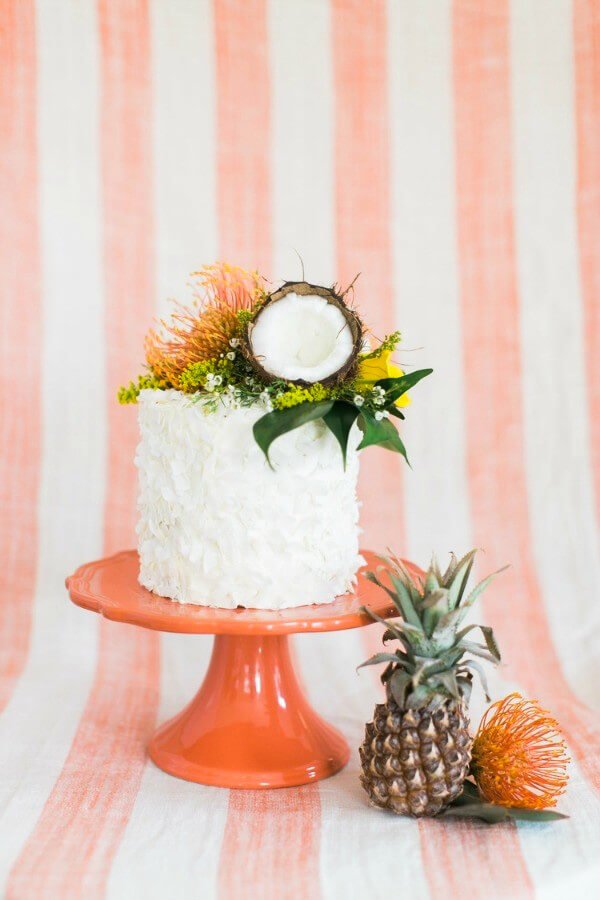
Image resolution: width=600 pixels, height=900 pixels. What are the coordinates of `cake plate portion of cake stand` in the screenshot? It's located at (318, 616).